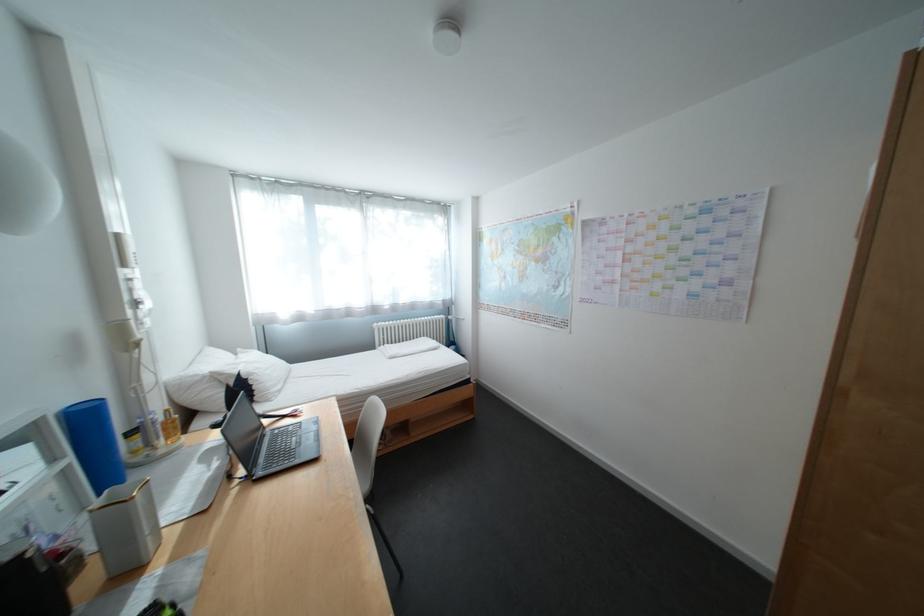
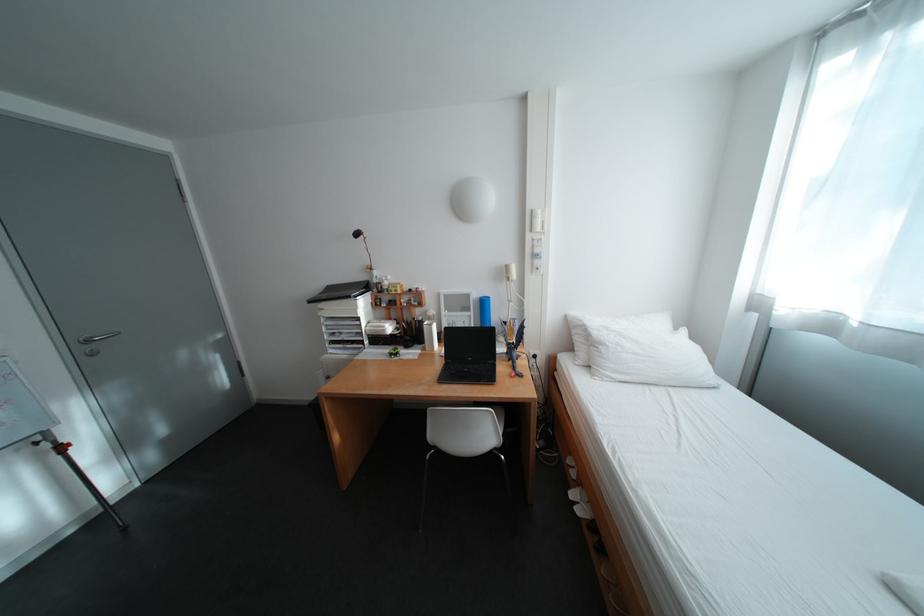
Find the pixel in the second image that matches (x=264, y=376) in the first image.

(614, 346)